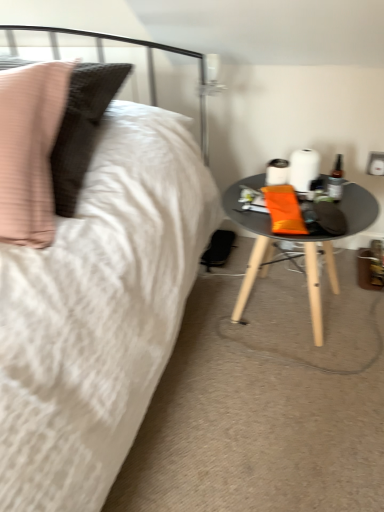
Image resolution: width=384 pixels, height=512 pixels. What are the coordinates of `free point above matte black table at lower right (from a real-world perspective)` in the screenshot? It's located at (302, 202).